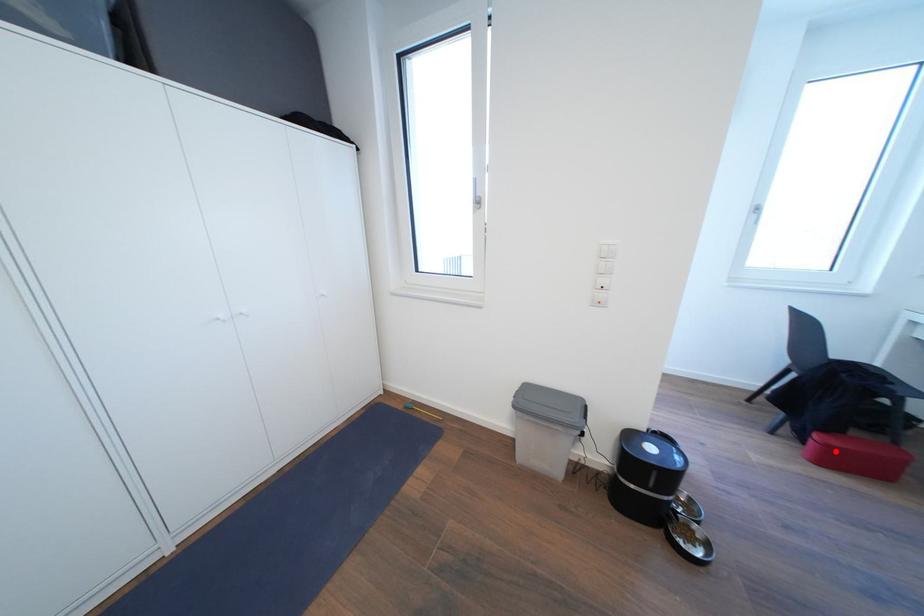
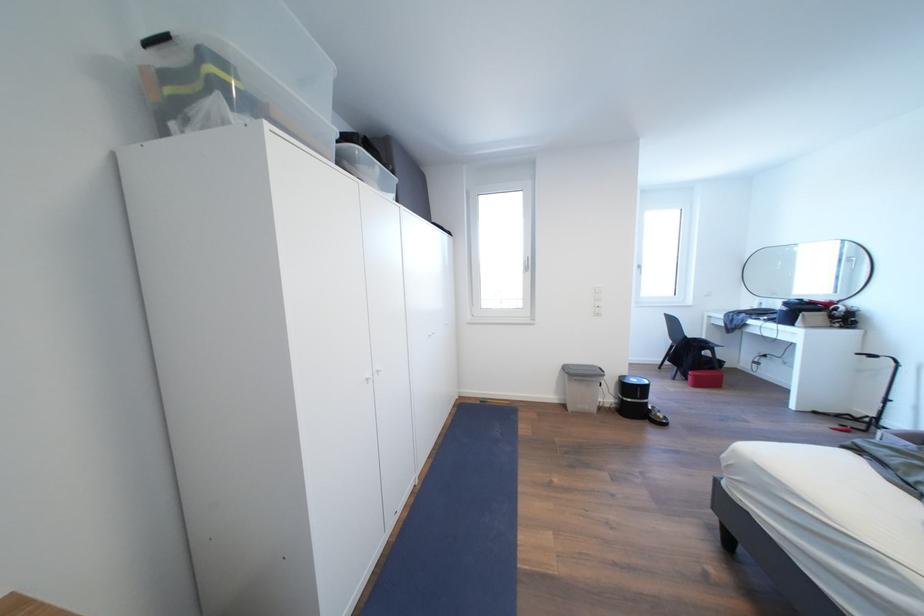
Question: I am providing you with two images of the same scene from different viewpoints. Image1 has a red point marked. In image2, the corresponding 3D location appears at what relative position? Reply with the corresponding letter.

Choices:
 (A) Closer
 (B) Farther

Answer: (B)